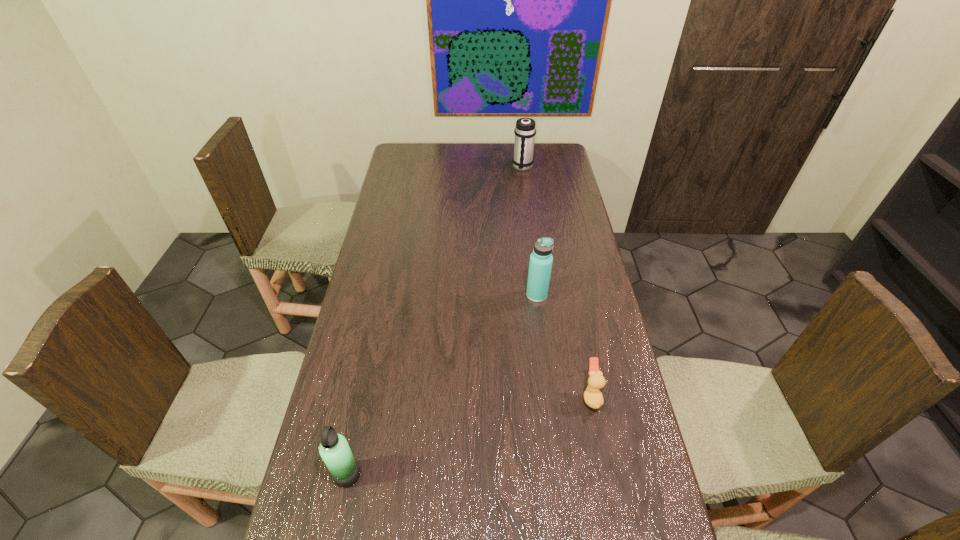
I want to click on free point between the second nearest object and the second farthest object, so click(564, 346).

At what (x,y) coordinates should I click in order to perform the action: click on free area in between the rightmost object and the second farthest object. Please return your answer as a coordinate pair (x, y). This screenshot has width=960, height=540. Looking at the image, I should click on [564, 346].

The width and height of the screenshot is (960, 540). Identify the location of blank region between the third farthest object and the leftmost object. (469, 436).

The width and height of the screenshot is (960, 540). Identify the location of vacant area between the farthest object and the second nearest thermos bottle. (530, 231).

This screenshot has height=540, width=960. In order to click on empty space that is in between the rightmost object and the farthest thermos bottle in this screenshot , I will do `click(557, 282)`.

At what (x,y) coordinates should I click in order to perform the action: click on unoccupied position between the leftmost object and the third nearest object. Please return your answer as a coordinate pair (x, y). The width and height of the screenshot is (960, 540). Looking at the image, I should click on (443, 385).

At what (x,y) coordinates should I click in order to perform the action: click on empty space between the third nearest object and the farthest thermos bottle. Please return your answer as a coordinate pair (x, y). This screenshot has width=960, height=540. Looking at the image, I should click on (530, 231).

Locate an element on the screen. The width and height of the screenshot is (960, 540). free spot between the second farthest object and the leftmost object is located at coordinates (443, 385).

Locate which object ranks second in proximity to the second farthest thermos bottle. Please provide its 2D coordinates. Your answer should be formatted as a tuple, i.e. [(x, y)], where the tuple contains the x and y coordinates of a point satisfying the conditions above.

[(334, 449)]

What are the coordinates of `the third closest object to the farthest thermos bottle` in the screenshot? It's located at (x=334, y=449).